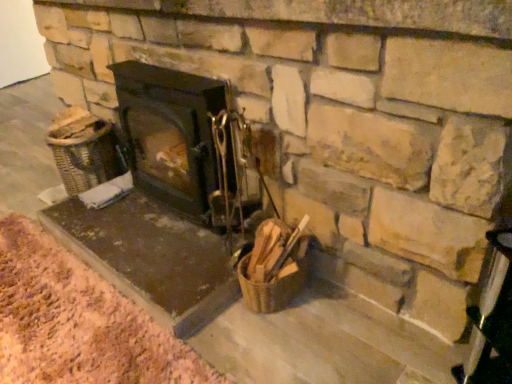
The image size is (512, 384). I want to click on free spot in front of matte black wood burning stove at center, so click(x=151, y=261).